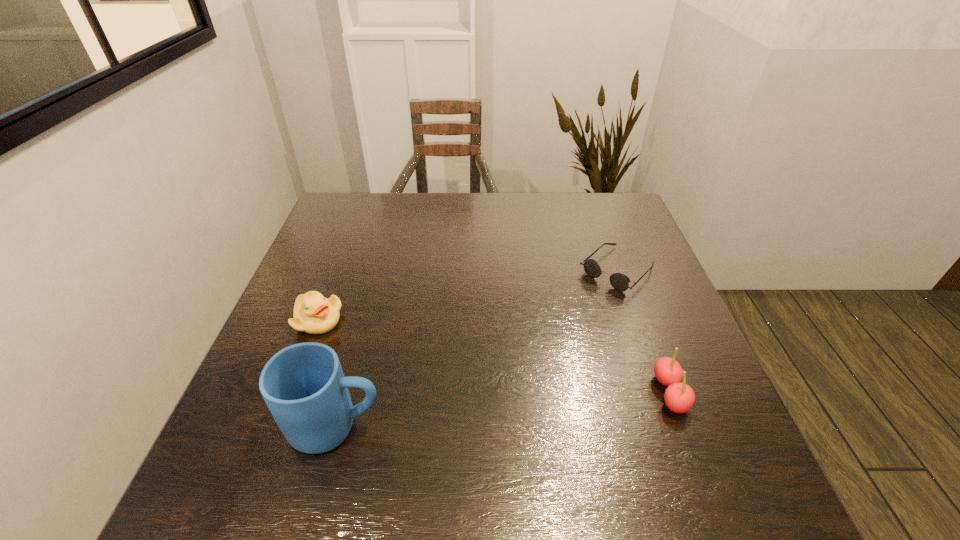
The height and width of the screenshot is (540, 960). Identify the location of free spot on the desktop that is between the tallest object and the cherry and is positioned at the face of the third nearest object. (534, 407).

This screenshot has width=960, height=540. Identify the location of vacant space on the desktop that is between the tallest object and the cherry and is positioned on the front-facing side of the shortest object. click(467, 414).